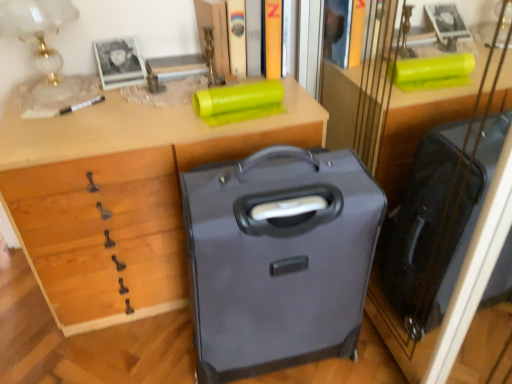
Identify the location of unoccupied region to the right of matte glass table lamp at upper left. This screenshot has width=512, height=384. (108, 106).